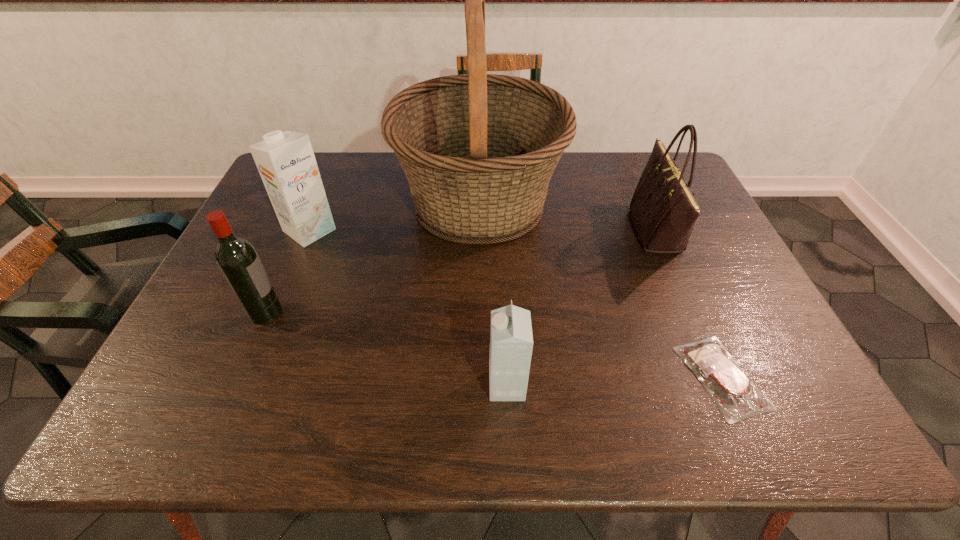
Identify the location of vacant point that satisfies the following two spatial constraints: 1. on the front-facing side of the handbag; 2. on the back side of the shortest object. (720, 377).

Find the location of `free space in the image that satisfies the following two spatial constraints: 1. on the front-facing side of the steak; 2. on the right side of the handbag`. free space in the image that satisfies the following two spatial constraints: 1. on the front-facing side of the steak; 2. on the right side of the handbag is located at coordinates (720, 377).